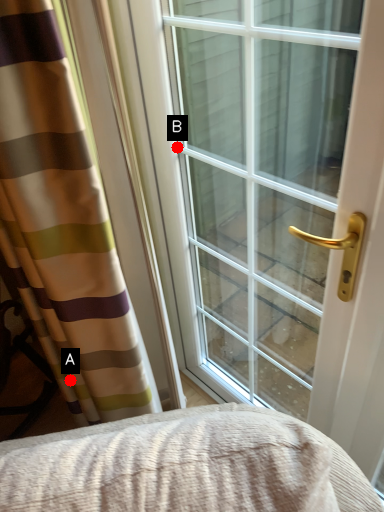
Question: Two points are circled on the image, labeled by A and B beside each circle. Among these points, which one is nearest to the camera?

Choices:
 (A) A is closer
 (B) B is closer

Answer: (B)